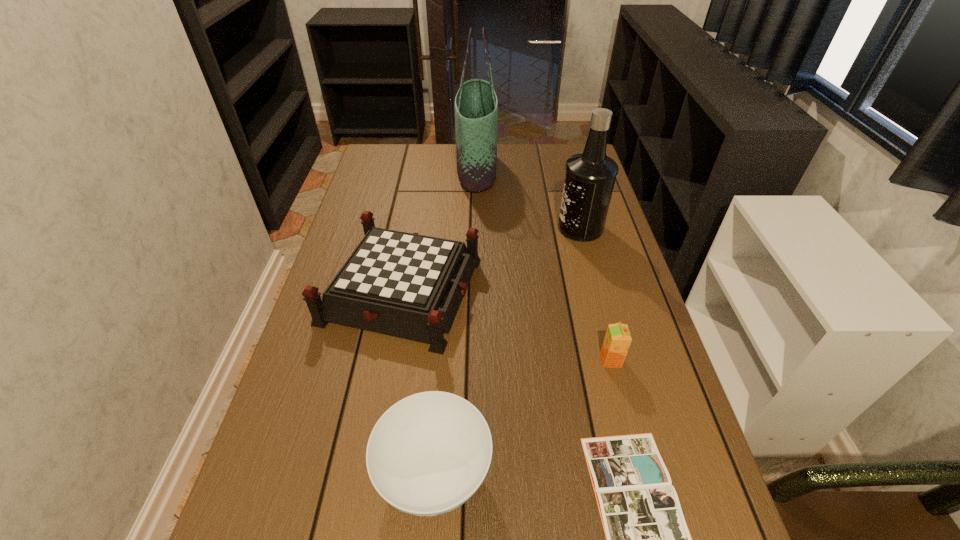
Locate an element on the screen. The width and height of the screenshot is (960, 540). free location located on the right of the checkerboard is located at coordinates (504, 291).

Find the location of a particular element. vacant space located 0.220m on the back of the orange juice is located at coordinates (591, 285).

Find the location of a particular element. The width and height of the screenshot is (960, 540). free space located on the back of the chinaware is located at coordinates (444, 341).

You are a GUI agent. You are given a task and a screenshot of the screen. Output one action in this format:
    pyautogui.click(x=<x>, y=<y>)
    Task: Click on the object situated at the far edge
    Image resolution: width=960 pixels, height=540 pixels.
    Given the screenshot: What is the action you would take?
    tap(476, 105)

Where is `object at the left edge`? object at the left edge is located at coordinates (402, 284).

Locate an element on the screen. Image resolution: width=960 pixels, height=540 pixels. liquor at the right edge is located at coordinates (590, 176).

Locate an element on the screen. The height and width of the screenshot is (540, 960). orange juice positioned at the right edge is located at coordinates (617, 340).

This screenshot has height=540, width=960. I want to click on vacant space at the far edge of the desktop, so click(516, 163).

Where is `vacant area at the left edge of the desktop`? The image size is (960, 540). vacant area at the left edge of the desktop is located at coordinates (358, 379).

Locate an element on the screen. The height and width of the screenshot is (540, 960). vacant space at the right edge of the desktop is located at coordinates (583, 247).